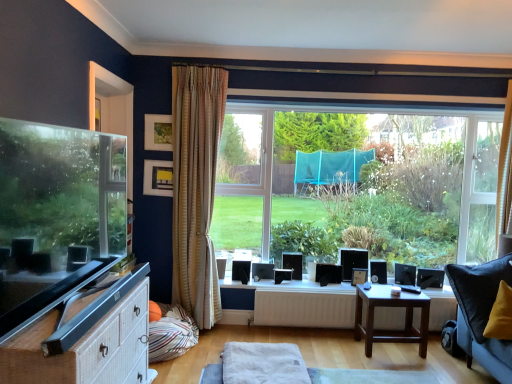
Question: Is black plastic speaker at lower right completely or partially inside striped fabric pillow at lower left?

Choices:
 (A) no
 (B) yes

Answer: (A)

Question: Can you confirm if striped fabric pillow at lower left is positioned to the right of black plastic speaker at lower right?

Choices:
 (A) no
 (B) yes

Answer: (A)

Question: Can you confirm if striped fabric pillow at lower left is smaller than black plastic speaker at lower right?

Choices:
 (A) no
 (B) yes

Answer: (A)

Question: From a real-world perspective, does striped fabric pillow at lower left stand above black plastic speaker at lower right?

Choices:
 (A) yes
 (B) no

Answer: (B)

Question: Is striped fabric pillow at lower left turned away from black plastic speaker at lower right?

Choices:
 (A) no
 (B) yes

Answer: (A)

Question: From their relative heights in the image, would you say white matte radiator at center is taller or shorter than matte black picture frame at upper center, which appears as the 1th picture frame when viewed from the right?

Choices:
 (A) tall
 (B) short

Answer: (A)

Question: From a real-world perspective, relative to matte black picture frame at upper center, which is counted as the 3th picture frame, starting from the top, is white matte radiator at center vertically above or below?

Choices:
 (A) above
 (B) below

Answer: (B)

Question: Is point (261, 304) positioned closer to the camera than point (358, 276)?

Choices:
 (A) closer
 (B) farther

Answer: (A)

Question: From the image's perspective, is white matte radiator at center positioned above or below matte black picture frame at upper center, acting as the third picture frame starting from the front?

Choices:
 (A) above
 (B) below

Answer: (B)

Question: Visually, is black plastic speaker at lower right positioned to the left or to the right of matte black picture frame at upper center, acting as the third picture frame starting from the front?

Choices:
 (A) right
 (B) left

Answer: (A)

Question: Looking at the image, does black plastic speaker at lower right seem bigger or smaller compared to matte black picture frame at upper center, acting as the third picture frame starting from the front?

Choices:
 (A) big
 (B) small

Answer: (A)

Question: Is black plastic speaker at lower right situated inside matte black picture frame at upper center, marked as the first picture frame in a bottom-to-top arrangement, or outside?

Choices:
 (A) inside
 (B) outside

Answer: (B)

Question: From their relative heights in the image, would you say black plastic speaker at lower right is taller or shorter than matte black picture frame at upper center, marked as the first picture frame in a bottom-to-top arrangement?

Choices:
 (A) short
 (B) tall

Answer: (B)

Question: Based on their positions, is wooden picture frame at upper center, the third picture frame when ordered from right to left, located to the left or right of white matte radiator at center?

Choices:
 (A) left
 (B) right

Answer: (A)

Question: Looking at their shapes, would you say wooden picture frame at upper center, the first picture frame from the front, is wider or thinner than white matte radiator at center?

Choices:
 (A) wide
 (B) thin

Answer: (B)